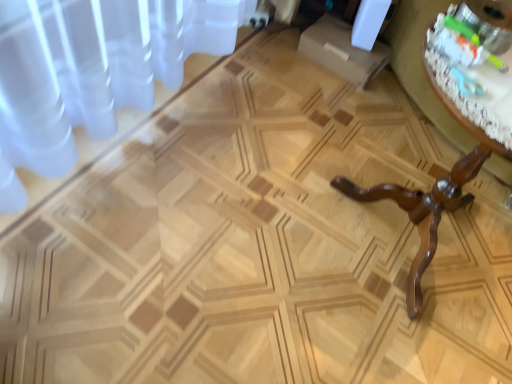
Find the location of a particular element. This screenshot has width=512, height=384. free space in front of wooden table at right is located at coordinates (373, 344).